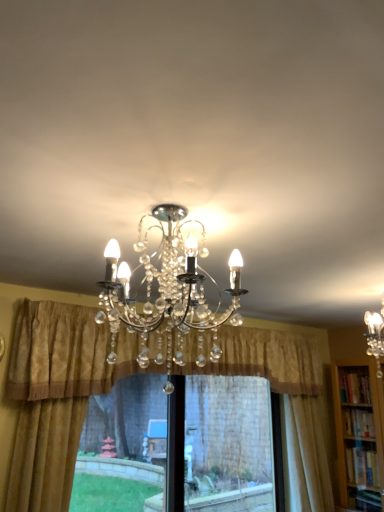
Question: Considering the positions of silky beige curtain at right, which ranks as the 1th curtain in right-to-left order, and gold textured curtain at center, the second curtain viewed from the left, in the image, is silky beige curtain at right, which ranks as the 1th curtain in right-to-left order, bigger or smaller than gold textured curtain at center, the second curtain viewed from the left,?

Choices:
 (A) small
 (B) big

Answer: (A)

Question: Considering their positions, is silky beige curtain at right, which ranks as the 1th curtain in right-to-left order, located in front of or behind gold textured curtain at center, which ranks as the second curtain in right-to-left order?

Choices:
 (A) front
 (B) behind

Answer: (B)

Question: Based on their relative distances, which object is nearer to the gold textured curtain at center, which ranks as the second curtain in right-to-left order?

Choices:
 (A) silky beige curtain at right, the third curtain from the left
 (B) green grass at lower left
 (C) clear crystal chandelier at center
 (D) gold textured curtain at left, which is the third curtain from right to left
 (E) transparent plastic window screen at center

Answer: (A)

Question: Which object is positioned farthest from the silky beige curtain at right, the third curtain from the left?

Choices:
 (A) gold textured curtain at center, which ranks as the second curtain in right-to-left order
 (B) gold textured curtain at left, which is the third curtain from right to left
 (C) clear crystal chandelier at center
 (D) green grass at lower left
 (E) transparent plastic window screen at center

Answer: (C)